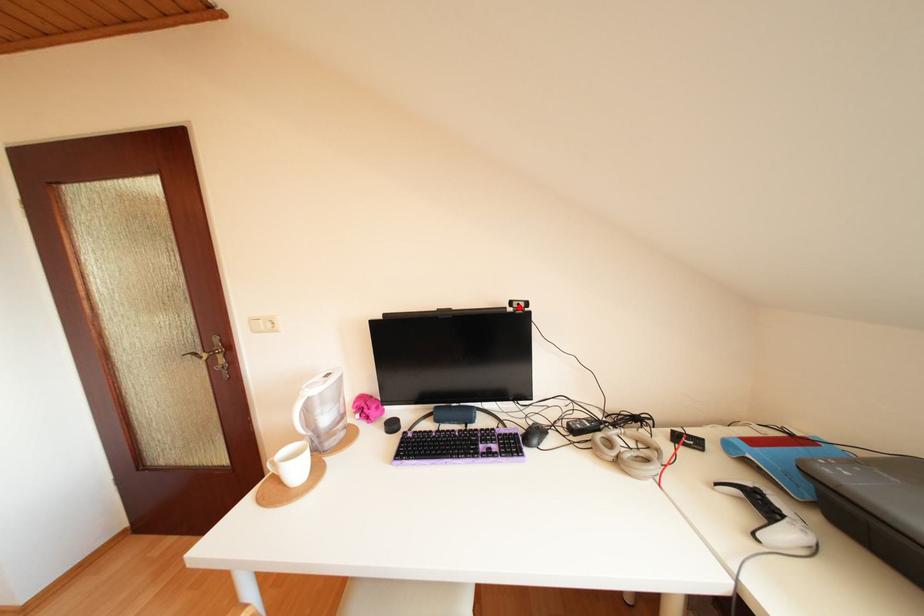
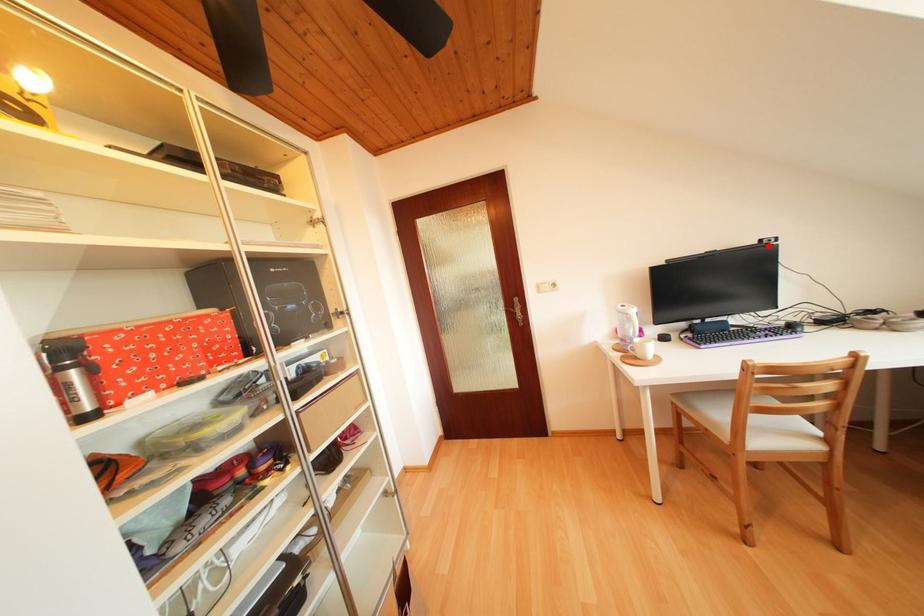
I am providing you with two images of the same scene from different viewpoints. A red point is marked on the first image and another point is marked on the second image. Do the highlighted points in image1 and image2 indicate the same real-world spot?

Yes